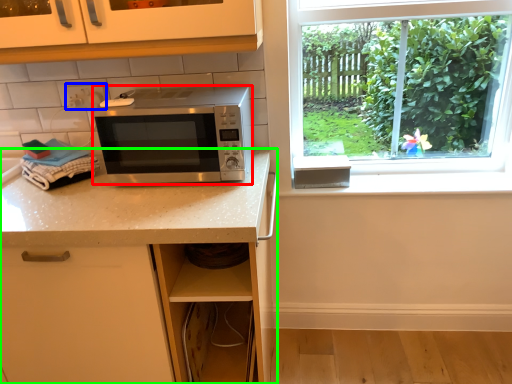
Question: Which object is the closest to the microwave oven (highlighted by a red box)? Choose among these: electric outlet (highlighted by a blue box) or countertop (highlighted by a green box).

Choices:
 (A) electric outlet
 (B) countertop

Answer: (B)